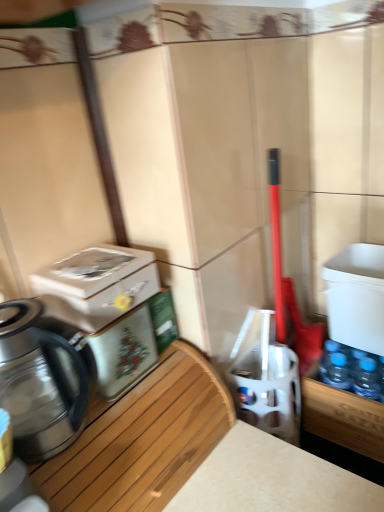
Question: In terms of height, does white plastic water cooler at right, the first water cooler positioned from the right, look taller or shorter compared to shiny metallic kettle at left?

Choices:
 (A) short
 (B) tall

Answer: (A)

Question: Is white plastic water cooler at right, the first water cooler positioned from the right, bigger or smaller than shiny metallic kettle at left?

Choices:
 (A) small
 (B) big

Answer: (B)

Question: Estimate the real-world distances between objects in this image. Which object is closer to the woodenmaterial/texture at left?

Choices:
 (A) white plastic water cooler at right, acting as the 3th water cooler starting from the left
 (B) shiny metallic kettle at left
 (C) white glossy water cooler at center, placed as the 2th water cooler when sorted from left to right
 (D) metallic silver water cooler at left, the 1th water cooler from the left

Answer: (B)

Question: Considering the real-world distances, which object is farthest from the metallic silver water cooler at left, the 1th water cooler from the left?

Choices:
 (A) white plastic water cooler at right, the first water cooler positioned from the right
 (B) woodenmaterial/texture at left
 (C) shiny metallic kettle at left
 (D) white glossy water cooler at center, placed as the 2th water cooler when sorted from left to right

Answer: (A)